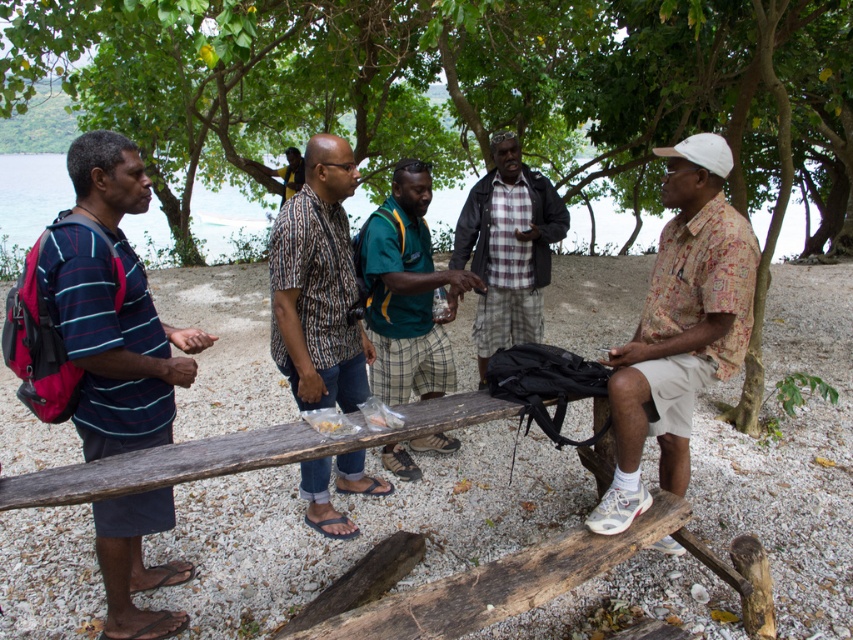
You are organizing a clothing donation drive and need to categorize the shirts based on their sizes. Given the two shirts in the scene, the matte blue shirt at left and the printed cotton shirt at right, which one should be placed in the small size bin?

The matte blue shirt at left should be placed in the small size bin because it has a smaller size compared to the printed cotton shirt at right.